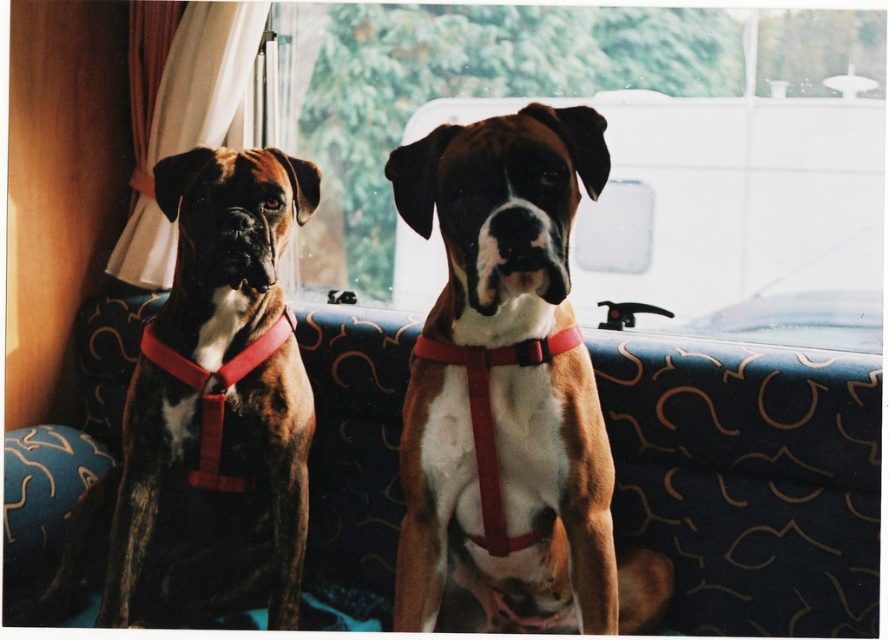
Question: Which of the following is the farthest from the observer?

Choices:
 (A) (391, 384)
 (B) (251, 176)

Answer: (A)

Question: Does blue fabric couch at center appear on the right side of brown brindle dog at left?

Choices:
 (A) yes
 (B) no

Answer: (A)

Question: Is transparent glass window at center to the right of brown matte dog at center from the viewer's perspective?

Choices:
 (A) yes
 (B) no

Answer: (A)

Question: Which point is farther to the camera?

Choices:
 (A) brown brindle dog at left
 (B) transparent glass window at center

Answer: (B)

Question: Is blue fabric couch at center thinner than brown brindle dog at left?

Choices:
 (A) no
 (B) yes

Answer: (B)

Question: Among these objects, which one is farthest from the camera?

Choices:
 (A) transparent glass window at center
 (B) blue fabric couch at center
 (C) brown brindle dog at left

Answer: (A)